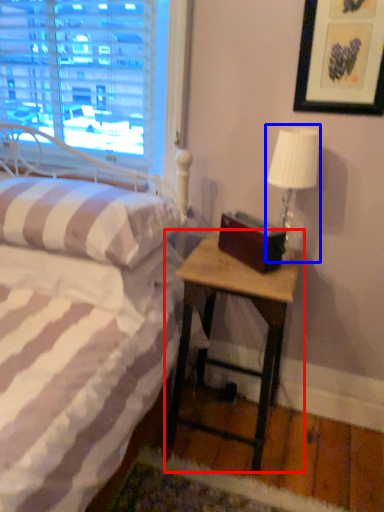
Question: Which object is closer to the camera taking this photo, nightstand (highlighted by a red box) or table lamp (highlighted by a blue box)?

Choices:
 (A) nightstand
 (B) table lamp

Answer: (A)